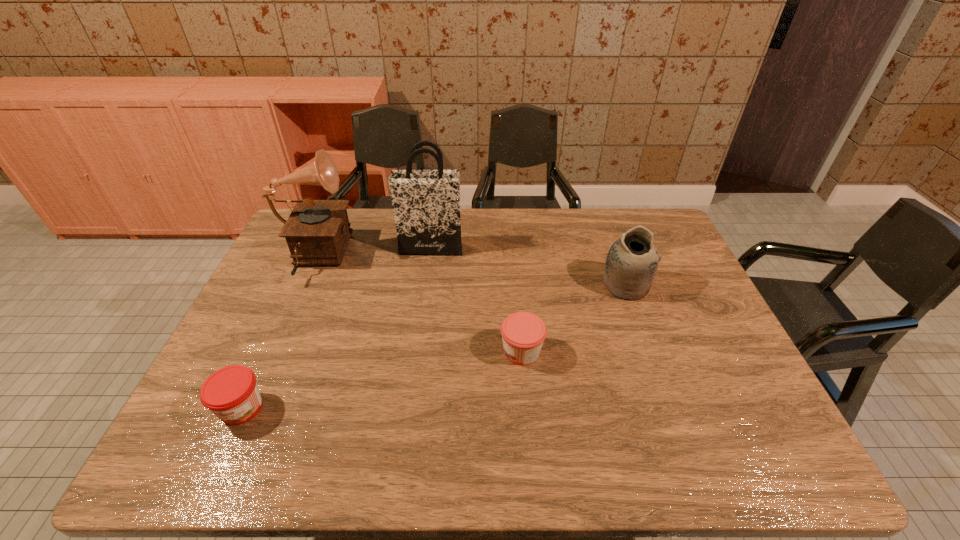
Where is `vacant area that lies between the record player and the rightmost object`? This screenshot has height=540, width=960. vacant area that lies between the record player and the rightmost object is located at coordinates (469, 272).

Identify the location of free area in between the farther jam and the third object from left to right. The height and width of the screenshot is (540, 960). (476, 300).

Image resolution: width=960 pixels, height=540 pixels. I want to click on unoccupied area between the shopping bag and the pottery, so click(x=528, y=266).

Where is `free space between the nearer jam and the shopping bag`? The height and width of the screenshot is (540, 960). free space between the nearer jam and the shopping bag is located at coordinates (336, 328).

Image resolution: width=960 pixels, height=540 pixels. I want to click on blank region between the third object from left to right and the right jam, so click(476, 300).

Select which object is the fourth closest to the right jam. Please provide its 2D coordinates. Your answer should be formatted as a tuple, i.e. [(x, y)], where the tuple contains the x and y coordinates of a point satisfying the conditions above.

[(231, 393)]

Identify which object is located as the second nearest to the fourth object from left to right. Please provide its 2D coordinates. Your answer should be formatted as a tuple, i.e. [(x, y)], where the tuple contains the x and y coordinates of a point satisfying the conditions above.

[(426, 203)]

Where is `free location that satisfies the following two spatial constraints: 1. on the horn of the record player; 2. on the label side of the nearer jam`? The width and height of the screenshot is (960, 540). free location that satisfies the following two spatial constraints: 1. on the horn of the record player; 2. on the label side of the nearer jam is located at coordinates (246, 408).

Find the location of a particular element. The width and height of the screenshot is (960, 540). free space in the image that satisfies the following two spatial constraints: 1. on the front of the third object from right to left with the design; 2. on the horn of the record player is located at coordinates (429, 258).

Find the location of a particular element. Image resolution: width=960 pixels, height=540 pixels. vacant space that satisfies the following two spatial constraints: 1. on the front side of the pottery; 2. on the front label of the right jam is located at coordinates (650, 352).